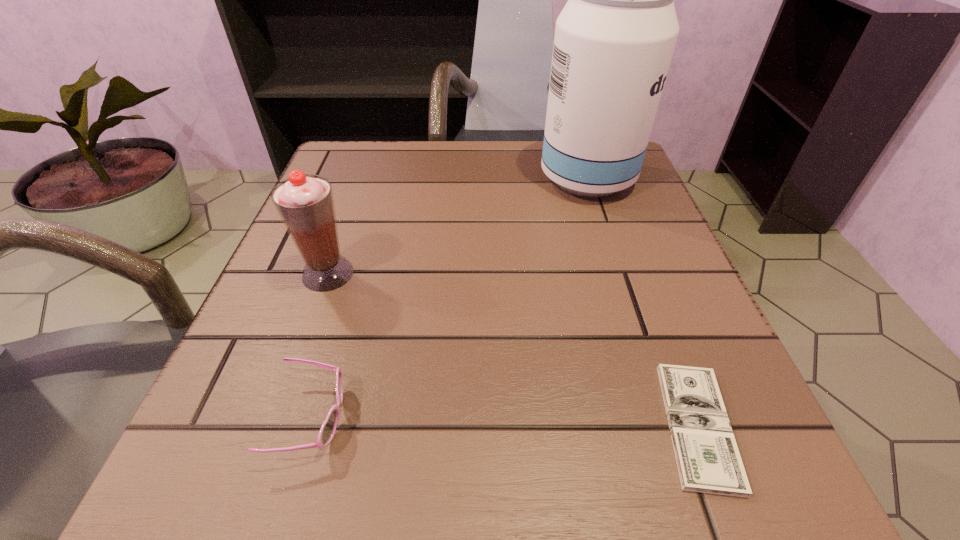
This screenshot has width=960, height=540. Identify the location of the farthest object. (614, 39).

Where is `the tallest object`? The height and width of the screenshot is (540, 960). the tallest object is located at coordinates (614, 39).

Find the location of a particular element. Image resolution: width=960 pixels, height=540 pixels. smoothie is located at coordinates (305, 203).

Where is `the second tallest object`? Image resolution: width=960 pixels, height=540 pixels. the second tallest object is located at coordinates (305, 203).

At what (x,y) coordinates should I click in order to perform the action: click on sunglasses. Please return your answer as a coordinate pair (x, y). Looking at the image, I should click on (328, 429).

The image size is (960, 540). I want to click on the shortest object, so click(708, 460).

The width and height of the screenshot is (960, 540). I want to click on vacant space situated on the front of the farthest object, so click(610, 246).

You are a GUI agent. You are given a task and a screenshot of the screen. Output one action in this format:
    pyautogui.click(x=<x>, y=<y>)
    Task: Click on the blank area located 0.070m on the front of the second tallest object
    
    Given the screenshot: What is the action you would take?
    pyautogui.click(x=309, y=326)

Locate an element on the screen. free point located on the front-facing side of the sunglasses is located at coordinates (444, 418).

Where is `vacant space located 0.200m on the left of the shortest object`? vacant space located 0.200m on the left of the shortest object is located at coordinates (495, 426).